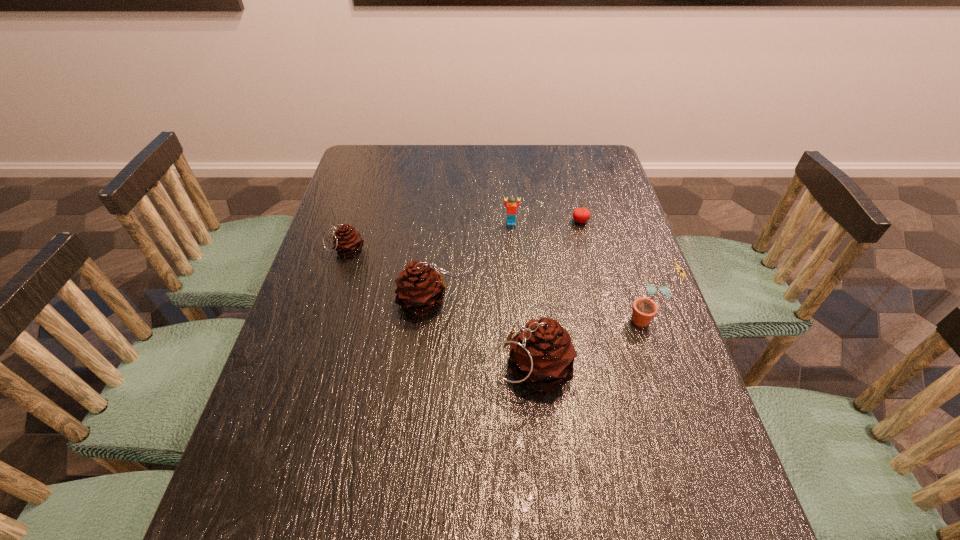
Identify the location of sunflower situated at the right edge. The height and width of the screenshot is (540, 960). (644, 309).

I want to click on free space at the left edge, so click(x=320, y=382).

Identify the location of vacant area at the right edge of the desktop. The image size is (960, 540). (686, 370).

This screenshot has width=960, height=540. In the image, there is a desktop. Identify the location of vacant space at the far left corner. (357, 162).

Identify the location of free point at the near left corner. (301, 468).

The height and width of the screenshot is (540, 960). What are the coordinates of `vacant space at the far right corner of the desktop` in the screenshot? It's located at (583, 160).

The height and width of the screenshot is (540, 960). What are the coordinates of `free space between the third tallest object and the nearest pinecone` in the screenshot? It's located at (479, 335).

I want to click on free point between the cherry and the second object from left to right, so click(504, 261).

Locate an element on the screen. free space between the fifth object from left to right and the sunflower is located at coordinates (613, 270).

You are a GUI agent. You are given a task and a screenshot of the screen. Output one action in this format:
    pyautogui.click(x=<x>, y=<y>)
    Task: Click on the free space between the Lego and the rightmost object
    This screenshot has height=540, width=960.
    Given the screenshot: What is the action you would take?
    pyautogui.click(x=579, y=271)